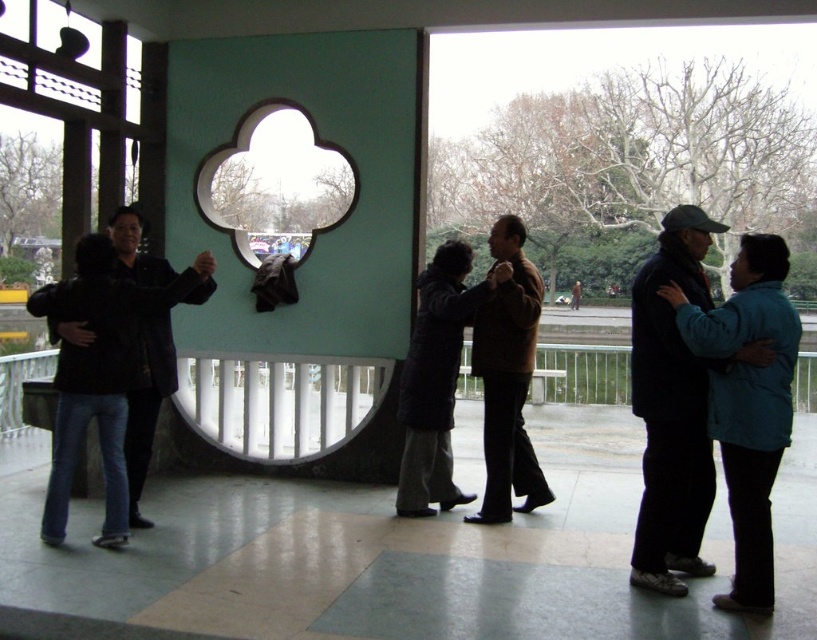
You are standing at the origin point of the coordinate system in the image. You want to move towards the dark blue jeans at left. What direction should you move in to reach them?

The dark blue jeans at left is located at coordinate point 0.603 on the x axis and 0.109 on the y axis. Since you are at the origin, you should move in the positive x and positive y direction to reach them.

You are standing in the covered outdoor area near the decorative window. You see a point marked at coordinates (748, 403). Which object does this point correspond to?

The point at coordinates (748, 403) corresponds to the blue fabric jacket at right.

You are a photographer trying to capture a clear shot of the dark blue jeans at left and the black matte jacket at left. Since you want both items to be visible in your photo, which one should you focus on to ensure the other remains in focus?

You should focus on the dark blue jeans at left because it is in front of the black matte jacket at left, so focusing on the front object will keep both in focus.